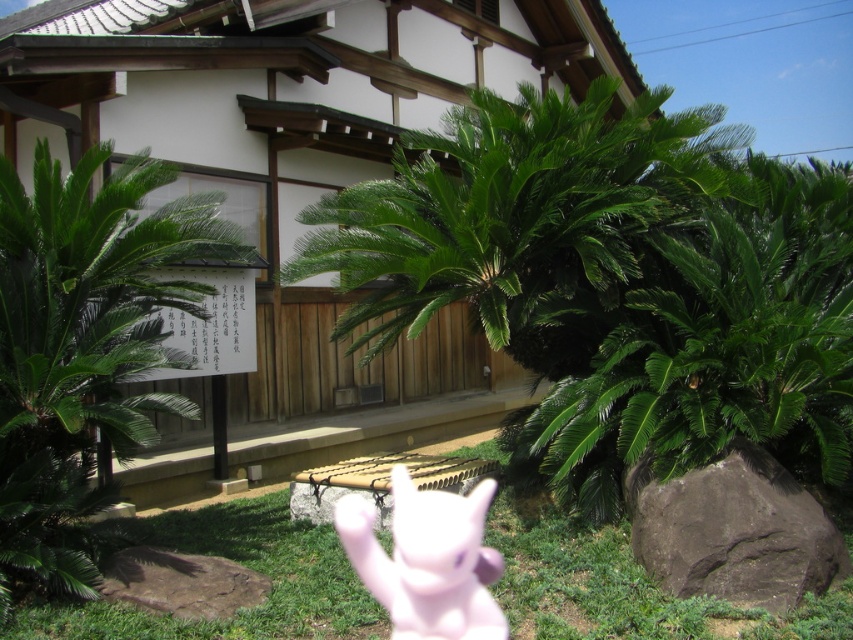
You are a visitor standing in the garden of the Japanese building. You see the green leafy palm tree at left and the pink rubber toy at center. Which object is nearer to you?

The green leafy palm tree at left is closer to the viewer than the pink rubber toy at center.

You are standing in the garden of a traditional Japanese building and see the green leafy palm tree at left and the green grass at lower center. Which object is positioned more to the left?

The green leafy palm tree at left is positioned more to the left than the green grass at lower center.